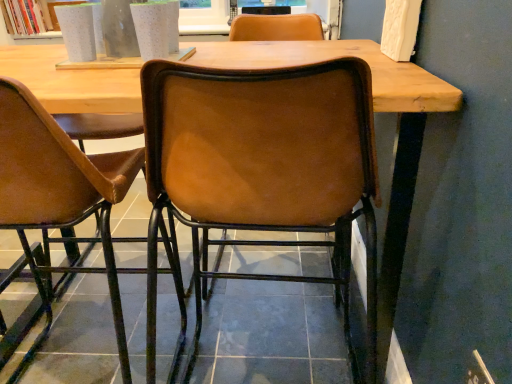
This screenshot has width=512, height=384. Describe the element at coordinates (60, 196) in the screenshot. I see `brown leather chair at center, the 1th chair in the left-to-right sequence` at that location.

Measure the distance between brown leather chair at center, which ranks as the 2th chair in right-to-left order, and camera.

brown leather chair at center, which ranks as the 2th chair in right-to-left order, is 3.30 feet from camera.

You are a GUI agent. You are given a task and a screenshot of the screen. Output one action in this format:
    pyautogui.click(x=<x>, y=<y>)
    Task: Click on the brown leather chair at center, which ranks as the 2th chair in right-to-left order
    
    Given the screenshot: What is the action you would take?
    pyautogui.click(x=60, y=196)

At what (x,y) coordinates should I click in order to perform the action: click on leather at center, the 2th chair viewed from the left. Please return your answer as a coordinate pair (x, y). The width and height of the screenshot is (512, 384). Looking at the image, I should click on (262, 168).

What do you see at coordinates (262, 168) in the screenshot? I see `leather at center, which appears as the 1th chair when viewed from the right` at bounding box center [262, 168].

Measure the distance between leather at center, which appears as the 1th chair when viewed from the right, and camera.

58.37 centimeters.

This screenshot has height=384, width=512. I want to click on brown leather chair at center, which ranks as the 2th chair in right-to-left order, so click(x=60, y=196).

Considering the positions of objects leather at center, the 2th chair viewed from the left, and brown leather chair at center, the 1th chair in the left-to-right sequence, in the image provided, who is more to the right, leather at center, the 2th chair viewed from the left, or brown leather chair at center, the 1th chair in the left-to-right sequence,?

leather at center, the 2th chair viewed from the left, is more to the right.

Which object is more forward, leather at center, which appears as the 1th chair when viewed from the right, or brown leather chair at center, which ranks as the 2th chair in right-to-left order?

leather at center, which appears as the 1th chair when viewed from the right, is in front.

Which is closer to the camera, (311, 95) or (77, 152)?

Clearly, point (311, 95) is closer to the camera than point (77, 152).

From the image's perspective, which one is positioned lower, leather at center, the 2th chair viewed from the left, or brown leather chair at center, which ranks as the 2th chair in right-to-left order?

leather at center, the 2th chair viewed from the left, appears lower in the image.

From a real-world perspective, who is located lower, leather at center, which appears as the 1th chair when viewed from the right, or brown leather chair at center, which ranks as the 2th chair in right-to-left order?

From a 3D spatial view, brown leather chair at center, which ranks as the 2th chair in right-to-left order, is below.

Considering the relative sizes of leather at center, which appears as the 1th chair when viewed from the right, and brown leather chair at center, which ranks as the 2th chair in right-to-left order, in the image provided, is leather at center, which appears as the 1th chair when viewed from the right, wider than brown leather chair at center, which ranks as the 2th chair in right-to-left order,?

Incorrect, the width of leather at center, which appears as the 1th chair when viewed from the right, does not surpass that of brown leather chair at center, which ranks as the 2th chair in right-to-left order.

From their relative heights in the image, would you say leather at center, the 2th chair viewed from the left, is taller or shorter than brown leather chair at center, the 1th chair in the left-to-right sequence?

leather at center, the 2th chair viewed from the left, is taller than brown leather chair at center, the 1th chair in the left-to-right sequence.

Considering the sizes of leather at center, which appears as the 1th chair when viewed from the right, and brown leather chair at center, which ranks as the 2th chair in right-to-left order, in the image, is leather at center, which appears as the 1th chair when viewed from the right, bigger or smaller than brown leather chair at center, which ranks as the 2th chair in right-to-left order,?

leather at center, which appears as the 1th chair when viewed from the right, is smaller than brown leather chair at center, which ranks as the 2th chair in right-to-left order.

Is leather at center, the 2th chair viewed from the left, not inside brown leather chair at center, the 1th chair in the left-to-right sequence?

That's correct, leather at center, the 2th chair viewed from the left, is outside of brown leather chair at center, the 1th chair in the left-to-right sequence.

Is leather at center, the 2th chair viewed from the left, positioned far away from brown leather chair at center, the 1th chair in the left-to-right sequence?

Actually, leather at center, the 2th chair viewed from the left, and brown leather chair at center, the 1th chair in the left-to-right sequence, are a little close together.

Is leather at center, the 2th chair viewed from the left, facing away from brown leather chair at center, which ranks as the 2th chair in right-to-left order?

No, leather at center, the 2th chair viewed from the left, is not facing away from brown leather chair at center, which ranks as the 2th chair in right-to-left order.

How many degrees apart are the facing directions of leather at center, which appears as the 1th chair when viewed from the right, and brown leather chair at center, the 1th chair in the left-to-right sequence?

The angle between the facing direction of leather at center, which appears as the 1th chair when viewed from the right, and the facing direction of brown leather chair at center, the 1th chair in the left-to-right sequence, is 2.25 degrees.

How far apart are leather at center, which appears as the 1th chair when viewed from the right, and brown leather chair at center, which ranks as the 2th chair in right-to-left order?

leather at center, which appears as the 1th chair when viewed from the right, and brown leather chair at center, which ranks as the 2th chair in right-to-left order, are 18.99 inches apart.

The height and width of the screenshot is (384, 512). I want to click on chair below the brown leather chair at center, the 1th chair in the left-to-right sequence (from the image's perspective), so click(262, 168).

Which object is positioned more to the left, brown leather chair at center, the 1th chair in the left-to-right sequence, or leather at center, the 2th chair viewed from the left?

brown leather chair at center, the 1th chair in the left-to-right sequence.

Which object is closer to the camera, brown leather chair at center, the 1th chair in the left-to-right sequence, or leather at center, the 2th chair viewed from the left?

leather at center, the 2th chair viewed from the left, is more forward.

Considering the points (53, 182) and (362, 375), which point is behind, point (53, 182) or point (362, 375)?

The point (362, 375) is more distant.

From the image's perspective, which object appears higher, brown leather chair at center, which ranks as the 2th chair in right-to-left order, or leather at center, which appears as the 1th chair when viewed from the right?

brown leather chair at center, which ranks as the 2th chair in right-to-left order, from the image's perspective.

From a real-world perspective, relative to leather at center, which appears as the 1th chair when viewed from the right, is brown leather chair at center, which ranks as the 2th chair in right-to-left order, vertically above or below?

Clearly, from a real-world perspective, brown leather chair at center, which ranks as the 2th chair in right-to-left order, is below leather at center, which appears as the 1th chair when viewed from the right.

Is brown leather chair at center, the 1th chair in the left-to-right sequence, thinner than leather at center, which appears as the 1th chair when viewed from the right?

No.

Is brown leather chair at center, the 1th chair in the left-to-right sequence, shorter than leather at center, the 2th chair viewed from the left?

Yes, brown leather chair at center, the 1th chair in the left-to-right sequence, is shorter than leather at center, the 2th chair viewed from the left.

Is brown leather chair at center, the 1th chair in the left-to-right sequence, bigger than leather at center, the 2th chair viewed from the left?

Indeed, brown leather chair at center, the 1th chair in the left-to-right sequence, has a larger size compared to leather at center, the 2th chair viewed from the left.

Based on the photo, is brown leather chair at center, which ranks as the 2th chair in right-to-left order, surrounding leather at center, the 2th chair viewed from the left?

No.

Is brown leather chair at center, the 1th chair in the left-to-right sequence, next to leather at center, the 2th chair viewed from the left?

No, brown leather chair at center, the 1th chair in the left-to-right sequence, is not with leather at center, the 2th chair viewed from the left.

Is brown leather chair at center, the 1th chair in the left-to-right sequence, looking in the opposite direction of leather at center, which appears as the 1th chair when viewed from the right?

No, brown leather chair at center, the 1th chair in the left-to-right sequence, is not facing away from leather at center, which appears as the 1th chair when viewed from the right.

What's the angular difference between brown leather chair at center, which ranks as the 2th chair in right-to-left order, and leather at center, which appears as the 1th chair when viewed from the right,'s facing directions?

brown leather chair at center, which ranks as the 2th chair in right-to-left order, and leather at center, which appears as the 1th chair when viewed from the right, are facing 2.25 degrees away from each other.

Image resolution: width=512 pixels, height=384 pixels. I want to click on chair on the right of brown leather chair at center, which ranks as the 2th chair in right-to-left order, so click(x=262, y=168).

You are a GUI agent. You are given a task and a screenshot of the screen. Output one action in this format:
    pyautogui.click(x=<x>, y=<y>)
    Task: Click on the chair above the brown leather chair at center, the 1th chair in the left-to-right sequence (from a real-world perspective)
    
    Given the screenshot: What is the action you would take?
    pyautogui.click(x=262, y=168)

You are a GUI agent. You are given a task and a screenshot of the screen. Output one action in this format:
    pyautogui.click(x=<x>, y=<y>)
    Task: Click on the chair that appears in front of the brown leather chair at center, the 1th chair in the left-to-right sequence
    
    Given the screenshot: What is the action you would take?
    pyautogui.click(x=262, y=168)